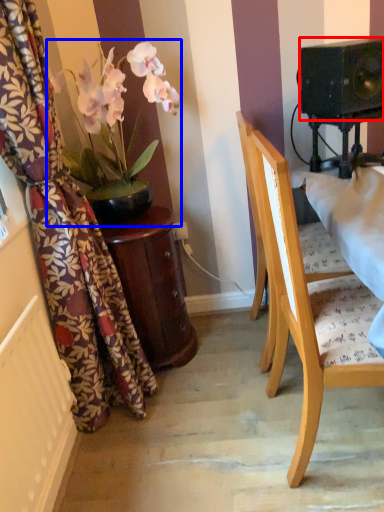
Question: Which object is further to the camera taking this photo, speaker (highlighted by a red box) or houseplant (highlighted by a blue box)?

Choices:
 (A) speaker
 (B) houseplant

Answer: (B)